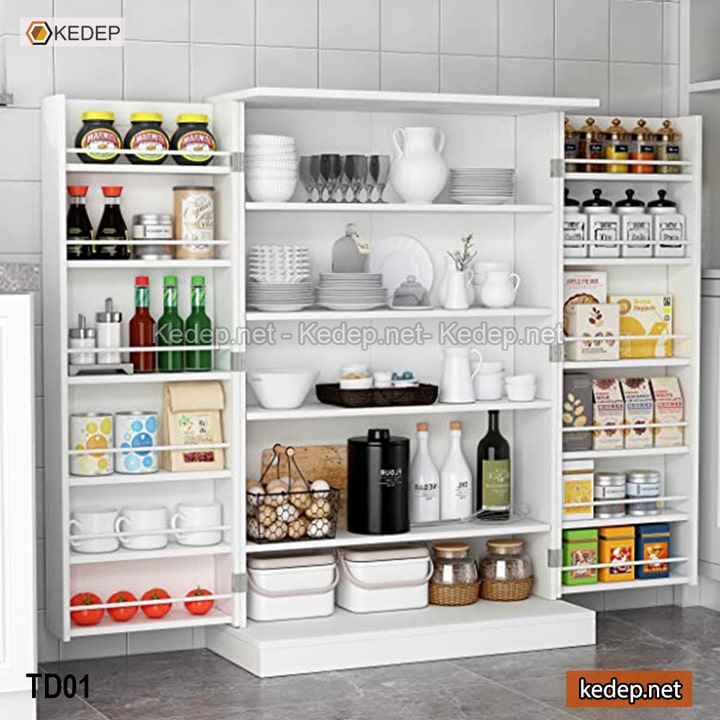
Where is `bottles`? The height and width of the screenshot is (720, 720). bottles is located at coordinates (418, 481), (458, 487), (486, 474), (142, 330), (173, 320), (199, 320), (71, 220), (111, 225).